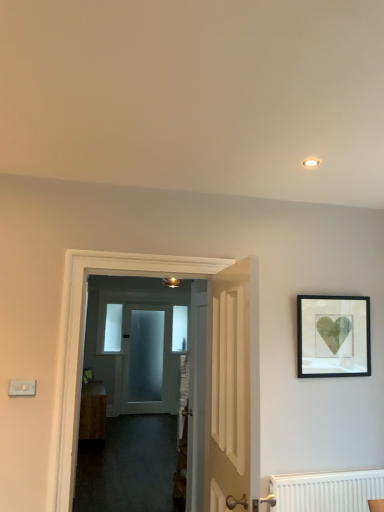
What do you see at coordinates (179, 328) in the screenshot? This screenshot has width=384, height=512. I see `clear glass window at center, the 1th window from the back` at bounding box center [179, 328].

Identify the location of white plastic light switch at lower left. Image resolution: width=384 pixels, height=512 pixels. (22, 388).

This screenshot has width=384, height=512. Describe the element at coordinates (83, 337) in the screenshot. I see `white wooden door at center, which is counted as the second door, starting from the back` at that location.

The height and width of the screenshot is (512, 384). Describe the element at coordinates (113, 328) in the screenshot. I see `clear glass door at center, the 2th window when ordered from right to left` at that location.

The width and height of the screenshot is (384, 512). I want to click on frosted glass door at center, the 1th door when ordered from back to front, so click(146, 360).

From a real-world perspective, is black matte picture frame at upper right beneath white wooden door at center, the 1th door when ordered from front to back?

No.

Looking at the image, does black matte picture frame at upper right seem bigger or smaller compared to white wooden door at center, the 1th door when ordered from front to back?

Clearly, black matte picture frame at upper right is smaller in size than white wooden door at center, the 1th door when ordered from front to back.

Looking at this image, from the image's perspective, is black matte picture frame at upper right located beneath white wooden door at center, which is the 3th door from back to front?

No.

Which of these two, clear glass window at center, marked as the 2th window in a left-to-right arrangement, or frosted glass door at center, the 1th door when ordered from back to front, is wider?

frosted glass door at center, the 1th door when ordered from back to front.

Relative to frosted glass door at center, the 1th door when ordered from back to front, is clear glass window at center, marked as the 2th window in a left-to-right arrangement, in front or behind?

clear glass window at center, marked as the 2th window in a left-to-right arrangement, is behind frosted glass door at center, the 1th door when ordered from back to front.

Could frosted glass door at center, the 1th door when ordered from back to front, be considered to be inside clear glass window at center, which ranks as the 1th window in right-to-left order?

Actually, frosted glass door at center, the 1th door when ordered from back to front, is outside clear glass window at center, which ranks as the 1th window in right-to-left order.

Is white wooden door at center, positioned as the second door in front-to-back order, wider or thinner than wooden cabinet at center?

Considering their sizes, white wooden door at center, positioned as the second door in front-to-back order, looks slimmer than wooden cabinet at center.

Which of these two, white wooden door at center, positioned as the second door in front-to-back order, or wooden cabinet at center, stands shorter?

wooden cabinet at center is shorter.

Is white wooden door at center, which is counted as the second door, starting from the back, positioned in front of wooden cabinet at center?

Yes, it is.

Consider the image. Would you consider white wooden door at center, positioned as the second door in front-to-back order, to be distant from wooden cabinet at center?

Yes.

Does clear glass door at center, the first window from the front, turn towards white wooden door at center, which is the 3th door from back to front?

Yes, clear glass door at center, the first window from the front, is oriented towards white wooden door at center, which is the 3th door from back to front.

Is clear glass door at center, which is counted as the second window, starting from the back, next to white wooden door at center, which is the 3th door from back to front, and touching it?

No, clear glass door at center, which is counted as the second window, starting from the back, is not making contact with white wooden door at center, which is the 3th door from back to front.

Considering the relative sizes of clear glass door at center, which is counted as the second window, starting from the back, and white wooden door at center, the 1th door when ordered from front to back, in the image provided, is clear glass door at center, which is counted as the second window, starting from the back, wider than white wooden door at center, the 1th door when ordered from front to back,?

No, clear glass door at center, which is counted as the second window, starting from the back, is not wider than white wooden door at center, the 1th door when ordered from front to back.

Is clear glass door at center, which ranks as the first window in left-to-right order, located outside white wooden door at center, which is the 3th door from back to front?

clear glass door at center, which ranks as the first window in left-to-right order, lies outside white wooden door at center, which is the 3th door from back to front,'s area.

Is clear glass window at center, marked as the 2th window in a left-to-right arrangement, oriented away from black matte picture frame at upper right?

No, clear glass window at center, marked as the 2th window in a left-to-right arrangement, is not facing away from black matte picture frame at upper right.

From the image's perspective, is clear glass window at center, the 1th window from the back, located above black matte picture frame at upper right?

No.

From the picture: Can you tell me how much clear glass window at center, which ranks as the 1th window in right-to-left order, and black matte picture frame at upper right differ in facing direction?

They differ by 2.77 degrees in their facing directions.

In the scene shown: Is clear glass window at center, the 1th window from the back, closer to the viewer compared to black matte picture frame at upper right?

No, the depth of clear glass window at center, the 1th window from the back, is greater than that of black matte picture frame at upper right.

Does point (370, 360) come closer to viewer compared to point (183, 346)?

Yes, it is.

Considering the relative sizes of black matte picture frame at upper right and clear glass window at center, acting as the 2th window starting from the front, in the image provided, is black matte picture frame at upper right taller than clear glass window at center, acting as the 2th window starting from the front,?

No.

Is black matte picture frame at upper right wider or thinner than clear glass window at center, marked as the 2th window in a left-to-right arrangement?

Considering their sizes, black matte picture frame at upper right looks slimmer than clear glass window at center, marked as the 2th window in a left-to-right arrangement.

Is black matte picture frame at upper right inside the boundaries of clear glass window at center, the 1th window from the back, or outside?

black matte picture frame at upper right exists outside the volume of clear glass window at center, the 1th window from the back.

From the picture: Considering the sizes of frosted glass door at center, the 1th door when ordered from back to front, and white wooden door at center, the 1th door when ordered from front to back, in the image, is frosted glass door at center, the 1th door when ordered from back to front, wider or thinner than white wooden door at center, the 1th door when ordered from front to back,?

Clearly, frosted glass door at center, the 1th door when ordered from back to front, has less width compared to white wooden door at center, the 1th door when ordered from front to back.

In the scene shown: Is frosted glass door at center, the 1th door when ordered from back to front, next to white wooden door at center, which is the 3th door from back to front, and touching it?

No, frosted glass door at center, the 1th door when ordered from back to front, is not beside white wooden door at center, which is the 3th door from back to front.

Does frosted glass door at center, placed as the 3th door when sorted from front to back, turn towards white wooden door at center, the 1th door when ordered from front to back?

Yes, frosted glass door at center, placed as the 3th door when sorted from front to back, is turned towards white wooden door at center, the 1th door when ordered from front to back.

In the scene shown: Considering their positions, is frosted glass door at center, placed as the 3th door when sorted from front to back, located in front of or behind white wooden door at center, which is the 3th door from back to front?

In the image, frosted glass door at center, placed as the 3th door when sorted from front to back, appears behind white wooden door at center, which is the 3th door from back to front.

Where is `the 1st door to the left of the black matte picture frame at upper right, counting from the anchor's position`? This screenshot has width=384, height=512. the 1st door to the left of the black matte picture frame at upper right, counting from the anchor's position is located at coordinates (233, 387).

There is a frosted glass door at center, placed as the 3th door when sorted from front to back. Identify the location of the 1st window above it (from the image's perspective). The height and width of the screenshot is (512, 384). tap(179, 328).

Considering their positions, is white wooden door at center, which is counted as the second door, starting from the back, positioned closer to clear glass door at center, the first window from the front, than white plastic light switch at lower left?

white wooden door at center, which is counted as the second door, starting from the back.

From the image, which object appears to be farther from white plastic light switch at lower left, black matte picture frame at upper right or white wooden door at center, which is counted as the second door, starting from the back?

black matte picture frame at upper right is positioned further to the anchor white plastic light switch at lower left.

Estimate the real-world distances between objects in this image. Which object is further from frosted glass door at center, placed as the 3th door when sorted from front to back, white wooden door at center, the 1th door when ordered from front to back, or wooden cabinet at center?

white wooden door at center, the 1th door when ordered from front to back.

When comparing their distances from clear glass door at center, which ranks as the first window in left-to-right order, does wooden cabinet at center or black matte picture frame at upper right seem closer?

Based on the image, wooden cabinet at center appears to be nearer to clear glass door at center, which ranks as the first window in left-to-right order.

Based on their spatial positions, is white wooden door at center, positioned as the second door in front-to-back order, or black matte picture frame at upper right closer to clear glass window at center, which ranks as the 1th window in right-to-left order?

Among the two, black matte picture frame at upper right is located nearer to clear glass window at center, which ranks as the 1th window in right-to-left order.

Estimate the real-world distances between objects in this image. Which object is closer to clear glass door at center, the 2th window when ordered from right to left, frosted glass door at center, the 1th door when ordered from back to front, or white wooden door at center, which is the 3th door from back to front?

frosted glass door at center, the 1th door when ordered from back to front, is positioned closer to the anchor clear glass door at center, the 2th window when ordered from right to left.

Estimate the real-world distances between objects in this image. Which object is further from black matte picture frame at upper right, clear glass window at center, the 1th window from the back, or clear glass door at center, which is counted as the second window, starting from the back?

clear glass door at center, which is counted as the second window, starting from the back, is further to black matte picture frame at upper right.

Which object lies further to the anchor point white wooden door at center, positioned as the second door in front-to-back order, black matte picture frame at upper right or clear glass window at center, the 1th window from the back?

Among the two, clear glass window at center, the 1th window from the back, is located further to white wooden door at center, positioned as the second door in front-to-back order.

I want to click on door between white plastic light switch at lower left and clear glass window at center, which ranks as the 1th window in right-to-left order, along the z-axis, so click(146, 360).

The image size is (384, 512). I want to click on picture frame located between white plastic light switch at lower left and frosted glass door at center, placed as the 3th door when sorted from front to back, in the depth direction, so click(x=333, y=336).

The height and width of the screenshot is (512, 384). Identify the location of picture frame between white wooden door at center, the 1th door when ordered from front to back, and clear glass window at center, which ranks as the 1th window in right-to-left order, along the z-axis. (333, 336).

Locate an element on the screen. The image size is (384, 512). furniture positioned between white wooden door at center, which is counted as the second door, starting from the back, and clear glass door at center, the first window from the front, from near to far is located at coordinates (93, 411).